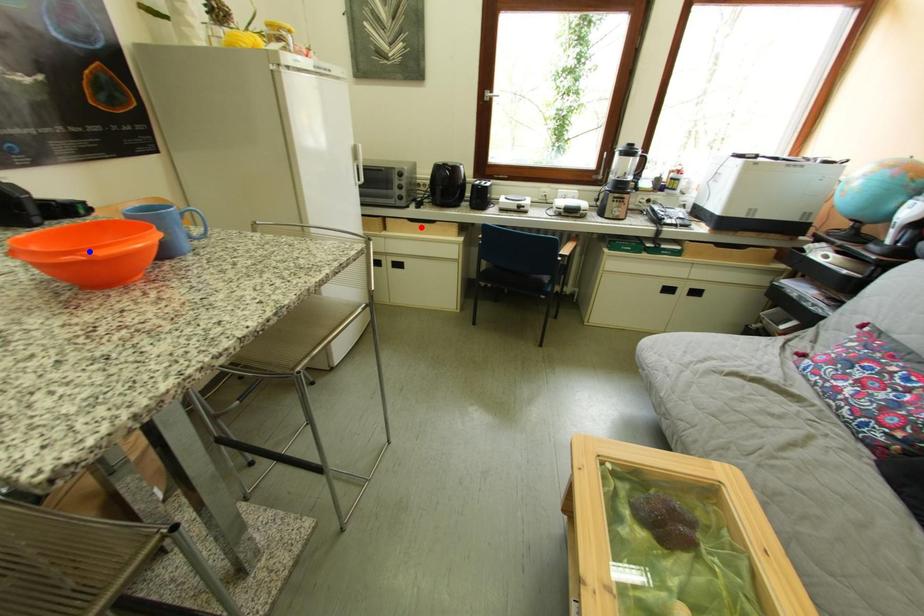
Question: Two points are marked on the image. Which point is closer to the camera?

Choices:
 (A) Blue point is closer.
 (B) Red point is closer.

Answer: (A)